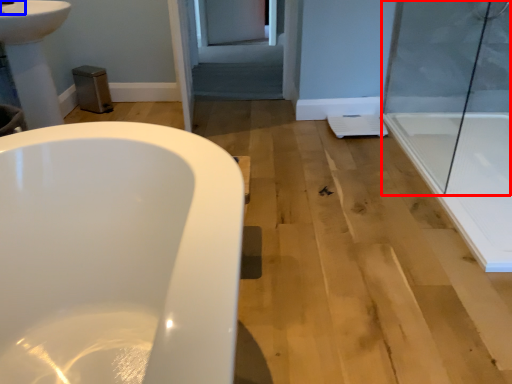
Question: Which object appears farthest to the camera in this image, shower door (highlighted by a red box) or faucet (highlighted by a blue box)?

Choices:
 (A) shower door
 (B) faucet

Answer: (B)